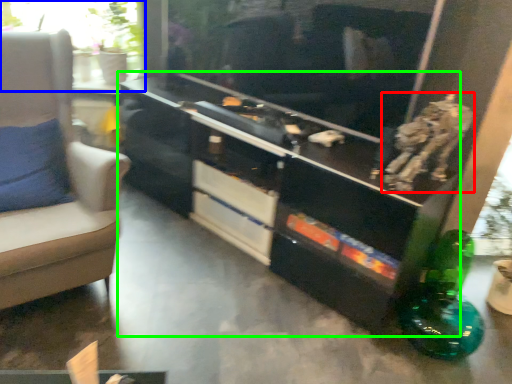
Question: Which is nearer to the animal (highlighted by a red box)? window (highlighted by a blue box) or entertainment center (highlighted by a green box).

Choices:
 (A) window
 (B) entertainment center

Answer: (B)